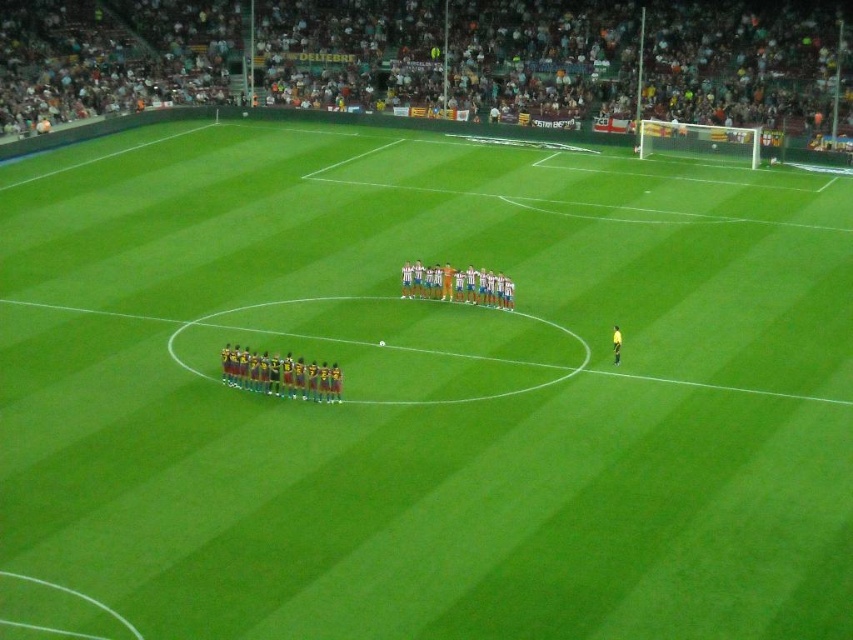
Does orange jersey at center have a larger size compared to yellow fabric referee at center?

Yes, orange jersey at center is bigger than yellow fabric referee at center.

Does orange jersey at center have a greater width compared to yellow fabric referee at center?

Correct, the width of orange jersey at center exceeds that of yellow fabric referee at center.

Who is more distant from viewer, (335, 58) or (619, 346)?

The point (335, 58) is behind.

Find the location of a particular element. This screenshot has height=640, width=853. orange jersey at center is located at coordinates (436, 58).

Is point (438, 280) less distant than point (614, 326)?

No, it is behind (614, 326).

This screenshot has width=853, height=640. Find the location of `striped jersey at center`. striped jersey at center is located at coordinates (456, 284).

You are a GUI agent. You are given a task and a screenshot of the screen. Output one action in this format:
    pyautogui.click(x=<x>, y=<y>)
    Task: Click on the yellow-green jersey at lower left
    This screenshot has width=853, height=640.
    Given the screenshot: What is the action you would take?
    pyautogui.click(x=280, y=374)

Is yellow-green jersey at lower left to the right of striped jersey at center from the viewer's perspective?

In fact, yellow-green jersey at lower left is to the left of striped jersey at center.

Where is `yellow-green jersey at lower left`? yellow-green jersey at lower left is located at coordinates (280, 374).

Image resolution: width=853 pixels, height=640 pixels. I want to click on yellow-green jersey at lower left, so click(x=280, y=374).